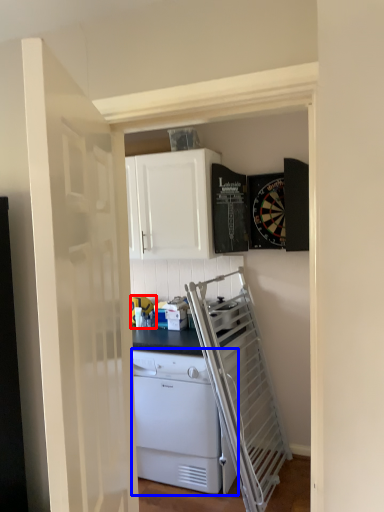
Question: Among these objects, which one is farthest to the camera, appliance (highlighted by a red box) or home appliance (highlighted by a blue box)?

Choices:
 (A) appliance
 (B) home appliance

Answer: (A)